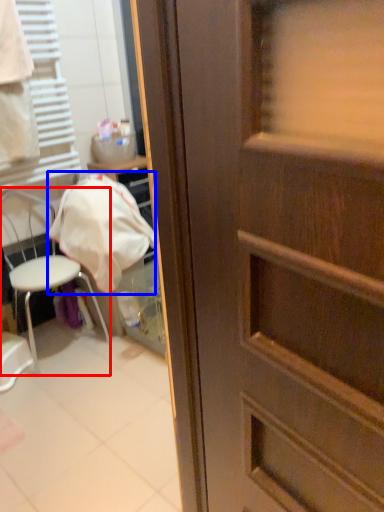
Question: Which object appears farthest to the camera in this image, chair (highlighted by a red box) or blanket (highlighted by a blue box)?

Choices:
 (A) chair
 (B) blanket

Answer: (B)